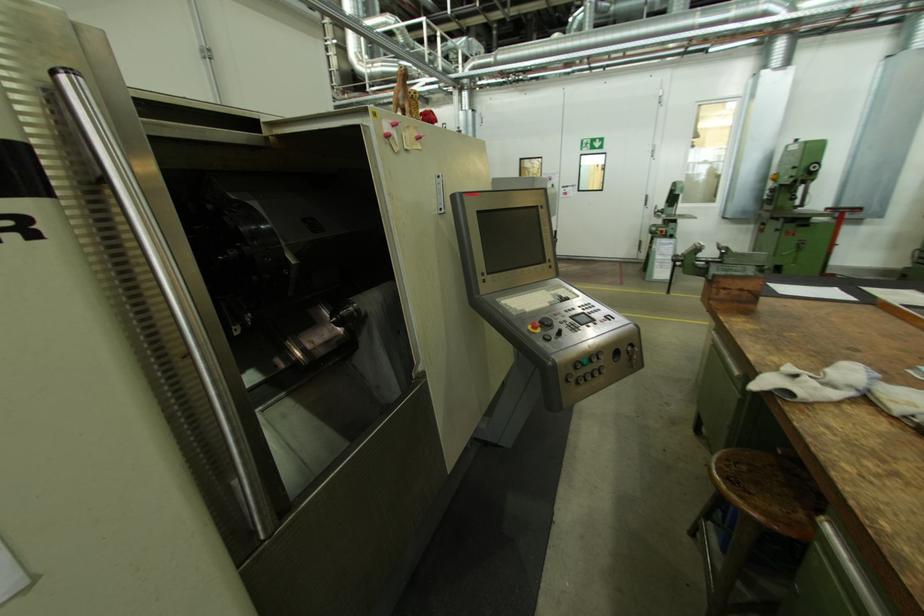
Locate an element on the screen. Image resolution: width=924 pixels, height=616 pixels. green push button is located at coordinates (549, 322).